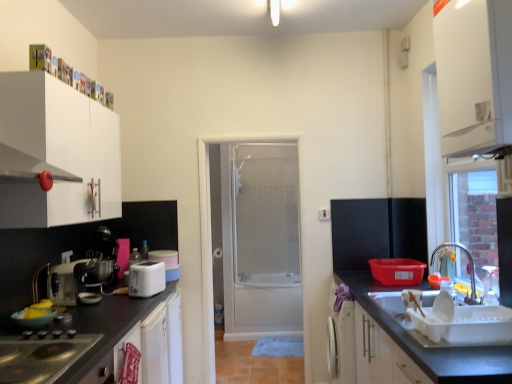
Describe the element at coordinates (56, 153) in the screenshot. The height and width of the screenshot is (384, 512). I see `white matte cabinet at left, the second cabinetry ordered from the bottom` at that location.

This screenshot has height=384, width=512. Find the location of `metallic silver coffee machine at left`. metallic silver coffee machine at left is located at coordinates (102, 260).

What do you see at coordinates (67, 281) in the screenshot? I see `metallic silver mixer at left, the 1th appliance from the front` at bounding box center [67, 281].

The width and height of the screenshot is (512, 384). Find the location of `white matte cabinet at lower left, placed as the third cabinetry when sorted from top to bottom`. white matte cabinet at lower left, placed as the third cabinetry when sorted from top to bottom is located at coordinates (148, 345).

You are a GUI agent. You are given a task and a screenshot of the screen. Output one action in this format:
    pyautogui.click(x=<x>, y=<y>)
    Task: Click on the white matte cabinet at upper right, the third cabinetry from the left
    The width and height of the screenshot is (512, 384).
    Given the screenshot: What is the action you would take?
    pyautogui.click(x=474, y=75)

From the image's perspective, between black glass gas stove at lower left and white plastic toaster at center, which is the first appliance in back-to-front order, who is located below?

black glass gas stove at lower left.

Is black glass gas stove at lower left aimed at white plastic toaster at center, which is the first appliance in back-to-front order?

No, black glass gas stove at lower left is not facing towards white plastic toaster at center, which is the first appliance in back-to-front order.

Based on the photo, is black glass gas stove at lower left with white plastic toaster at center, which is the first appliance in back-to-front order?

No, black glass gas stove at lower left is not with white plastic toaster at center, which is the first appliance in back-to-front order.

Considering the sizes of objects white matte cabinet at left, which appears as the third cabinetry when viewed from the right, and white plastic toaster at left, the 2th appliance viewed from the back, in the image provided, who is thinner, white matte cabinet at left, which appears as the third cabinetry when viewed from the right, or white plastic toaster at left, the 2th appliance viewed from the back,?

white plastic toaster at left, the 2th appliance viewed from the back.

Considering the positions of objects white matte cabinet at left, the second cabinetry ordered from the bottom, and white plastic toaster at left, marked as the 2th appliance in a front-to-back arrangement, in the image provided, who is in front, white matte cabinet at left, the second cabinetry ordered from the bottom, or white plastic toaster at left, marked as the 2th appliance in a front-to-back arrangement,?

white matte cabinet at left, the second cabinetry ordered from the bottom.

Based on the photo, from a real-world perspective, which object stands above the other?

white matte cabinet at left, which appears as the first cabinetry when viewed from the left.

How far apart are black glass gas stove at lower left and silver metallic faucet at right?

7.96 feet.

From the image's perspective, would you say black glass gas stove at lower left is positioned over silver metallic faucet at right?

No, from the image's perspective, black glass gas stove at lower left is not on top of silver metallic faucet at right.

Considering the relative positions of black glass gas stove at lower left and silver metallic faucet at right in the image provided, is black glass gas stove at lower left to the left or to the right of silver metallic faucet at right?

Clearly, black glass gas stove at lower left is on the left of silver metallic faucet at right in the image.

Considering the sizes of black glass gas stove at lower left and silver metallic faucet at right in the image, is black glass gas stove at lower left taller or shorter than silver metallic faucet at right?

In the image, black glass gas stove at lower left appears to be shorter than silver metallic faucet at right.

Which of these two, metallic silver mixer at left, the 1th appliance from the front, or white plastic toaster at center, which is the first appliance in back-to-front order, is thinner?

With smaller width is white plastic toaster at center, which is the first appliance in back-to-front order.

Is metallic silver mixer at left, the 1th appliance from the front, facing away from white plastic toaster at center, which is the 3th appliance from front to back?

That's not correct — metallic silver mixer at left, the 1th appliance from the front, is not looking away from white plastic toaster at center, which is the 3th appliance from front to back.

Which of these two, metallic silver mixer at left, which is counted as the 3th appliance, starting from the back, or white plastic toaster at center, which is the 3th appliance from front to back, stands taller?

With more height is metallic silver mixer at left, which is counted as the 3th appliance, starting from the back.

Based on the photo, is white plastic toaster at left, the 2th appliance viewed from the back, bigger than metallic silver coffee machine at left?

No.

In the scene shown: Considering the sizes of objects white plastic toaster at left, marked as the 2th appliance in a front-to-back arrangement, and metallic silver coffee machine at left in the image provided, who is wider, white plastic toaster at left, marked as the 2th appliance in a front-to-back arrangement, or metallic silver coffee machine at left?

Wider between the two is metallic silver coffee machine at left.

In the scene shown: From the image's perspective, between white plastic toaster at left, the 2th appliance viewed from the back, and metallic silver coffee machine at left, who is located below?

white plastic toaster at left, the 2th appliance viewed from the back, is shown below in the image.

Does point (162, 287) come closer to viewer compared to point (100, 263)?

Yes, it is in front of point (100, 263).

From the image's perspective, does metallic silver mixer at left, the 1th appliance from the front, appear lower than white plastic toaster at left, the 2th appliance viewed from the back?

No, from the image's perspective, metallic silver mixer at left, the 1th appliance from the front, is not beneath white plastic toaster at left, the 2th appliance viewed from the back.

Considering the points (80, 264) and (142, 271), which point is behind, point (80, 264) or point (142, 271)?

The point (142, 271) is farther from the camera.

Looking at this image, can you confirm if metallic silver mixer at left, the 1th appliance from the front, is wider than white plastic toaster at left, the 2th appliance viewed from the back?

Yes, metallic silver mixer at left, the 1th appliance from the front, is wider than white plastic toaster at left, the 2th appliance viewed from the back.

Is metallic silver mixer at left, the 1th appliance from the front, closer to the viewer compared to white plastic toaster at left, the 2th appliance viewed from the back?

Yes, metallic silver mixer at left, the 1th appliance from the front, is in front of white plastic toaster at left, the 2th appliance viewed from the back.

From the image's perspective, is white matte cabinet at left, the second cabinetry ordered from the bottom, above metallic silver mixer at left, which is counted as the 3th appliance, starting from the back?

Indeed, from the image's perspective, white matte cabinet at left, the second cabinetry ordered from the bottom, is shown above metallic silver mixer at left, which is counted as the 3th appliance, starting from the back.

Who is smaller, white matte cabinet at left, which appears as the third cabinetry when viewed from the right, or metallic silver mixer at left, the 1th appliance from the front?

With smaller size is metallic silver mixer at left, the 1th appliance from the front.

Is the depth of white matte cabinet at left, the 2th cabinetry viewed from the top, greater than that of metallic silver mixer at left, the 1th appliance from the front?

No, white matte cabinet at left, the 2th cabinetry viewed from the top, is closer to the camera.

At what (x,y) coordinates should I click in order to perform the action: click on gas stove lying in front of the white plastic toaster at center, which is the 3th appliance from front to back. Please return your answer as a coordinate pair (x, y). Looking at the image, I should click on (40, 358).

Locate an element on the screen. This screenshot has width=512, height=384. the 2nd appliance behind the white matte cabinet at left, which appears as the first cabinetry when viewed from the left, counting from the anchor's position is located at coordinates (146, 279).

From the image, which object appears to be farther from silver metallic faucet at right, white plastic toaster at center, which is the 3th appliance from front to back, or metallic silver mixer at left, the 1th appliance from the front?

metallic silver mixer at left, the 1th appliance from the front, is positioned further to the anchor silver metallic faucet at right.

Based on the photo, which object lies nearer to the anchor point silver metallic faucet at right, metallic silver mixer at left, the 1th appliance from the front, or black glass gas stove at lower left?

The object closer to silver metallic faucet at right is metallic silver mixer at left, the 1th appliance from the front.

Looking at the image, which one is located closer to silver metallic faucet at right, metallic silver mixer at left, the 1th appliance from the front, or white matte cabinet at lower left, which appears as the second cabinetry when viewed from the right?

The object closer to silver metallic faucet at right is white matte cabinet at lower left, which appears as the second cabinetry when viewed from the right.

Estimate the real-world distances between objects in this image. Which object is closer to white matte cabinet at upper right, the first cabinetry viewed from the right, white plastic toaster at center, which is the first appliance in back-to-front order, or metallic silver coffee machine at left?

Based on the image, white plastic toaster at center, which is the first appliance in back-to-front order, appears to be nearer to white matte cabinet at upper right, the first cabinetry viewed from the right.

Estimate the real-world distances between objects in this image. Which object is closer to white matte cabinet at left, the second cabinetry ordered from the bottom, metallic silver coffee machine at left or clear glass door at center?

The object closer to white matte cabinet at left, the second cabinetry ordered from the bottom, is metallic silver coffee machine at left.

Considering their positions, is white matte cabinet at upper right, the 3th cabinetry positioned from the bottom, positioned closer to white matte cabinet at left, which appears as the first cabinetry when viewed from the left, than white plastic toaster at left, marked as the 2th appliance in a front-to-back arrangement?

Based on the image, white plastic toaster at left, marked as the 2th appliance in a front-to-back arrangement, appears to be nearer to white matte cabinet at left, which appears as the first cabinetry when viewed from the left.

Considering their positions, is white matte cabinet at lower left, marked as the 1th cabinetry in a bottom-to-top arrangement, positioned further to silver metallic faucet at right than metallic silver mixer at left, the 1th appliance from the front?

metallic silver mixer at left, the 1th appliance from the front.

When comparing their distances from white matte cabinet at left, which appears as the third cabinetry when viewed from the right, does black glass gas stove at lower left or silver metallic faucet at right seem further?

silver metallic faucet at right is further to white matte cabinet at left, which appears as the third cabinetry when viewed from the right.

The image size is (512, 384). In order to click on countertop located between white matte cabinet at left, the 2th cabinetry viewed from the top, and white matte cabinet at upper right, the third cabinetry from the left, in the left-right direction in this screenshot , I will do `click(432, 348)`.

The image size is (512, 384). I want to click on cabinetry located between white plastic toaster at center, which is the first appliance in back-to-front order, and silver metallic faucet at right in the left-right direction, so click(x=474, y=75).

Where is `appliance between white plastic toaster at left, marked as the 2th appliance in a front-to-back arrangement, and clear glass door at center from left to right`? appliance between white plastic toaster at left, marked as the 2th appliance in a front-to-back arrangement, and clear glass door at center from left to right is located at coordinates (167, 262).

Where is `countertop between white matte cabinet at lower left, which appears as the second cabinetry when viewed from the right, and white matte cabinet at upper right, which is counted as the first cabinetry, starting from the top, in the horizontal direction`? countertop between white matte cabinet at lower left, which appears as the second cabinetry when viewed from the right, and white matte cabinet at upper right, which is counted as the first cabinetry, starting from the top, in the horizontal direction is located at coordinates (432, 348).